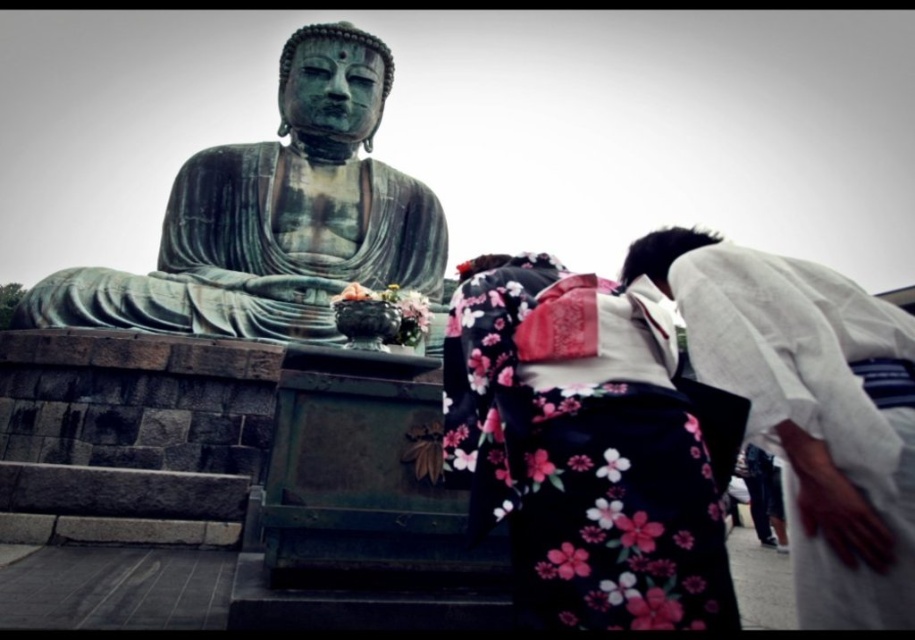
Between point (567, 444) and point (328, 204), which one is positioned in front?

Point (567, 444) is in front.

Can you confirm if floral kimono at center is positioned to the left of green patina statue at center?

No, floral kimono at center is not to the left of green patina statue at center.

This screenshot has width=915, height=640. Find the location of `floral kimono at center`. floral kimono at center is located at coordinates (587, 448).

This screenshot has height=640, width=915. What are the coordinates of `floral kimono at center` in the screenshot? It's located at (587, 448).

Which of these two, floral kimono at center or white cotton kimono at lower right, stands shorter?

floral kimono at center is shorter.

Between point (576, 400) and point (856, 417), which one is positioned in front?

Point (856, 417) is more forward.

Find the location of a particular element. This screenshot has width=915, height=640. floral kimono at center is located at coordinates (587, 448).

This screenshot has height=640, width=915. Describe the element at coordinates (274, 218) in the screenshot. I see `green patina statue at center` at that location.

Is point (266, 301) positioned behind point (894, 589)?

That is True.

Identify the location of green patina statue at center. (274, 218).